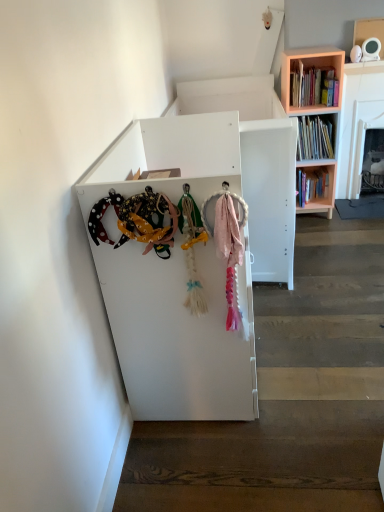
The image size is (384, 512). I want to click on free point above hardcover books at upper right (from a real-world perspective), so click(305, 55).